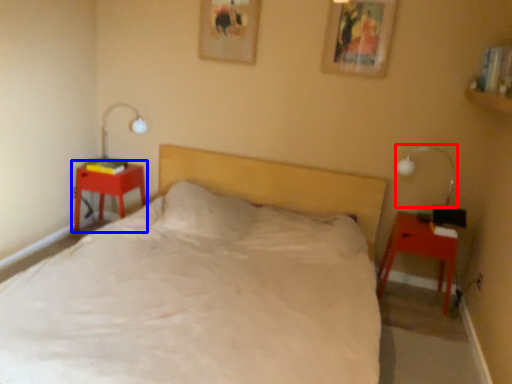
Question: Which object is closer to the camera taking this photo, bedside lamp (highlighted by a red box) or nightstand (highlighted by a blue box)?

Choices:
 (A) bedside lamp
 (B) nightstand

Answer: (A)